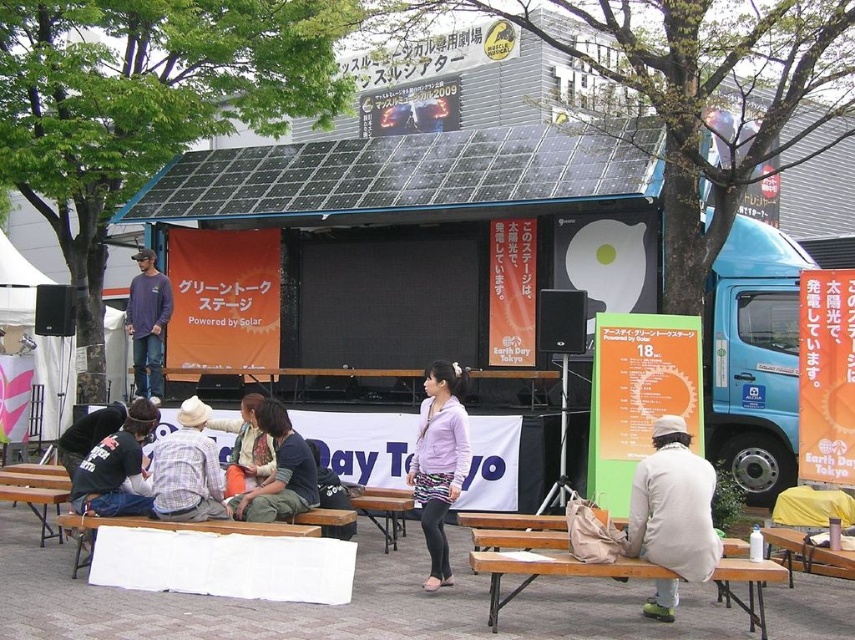
You are attending an Earth Day Tokyo event and notice two jackets on the stage. The white cotton jacket at lower right and the purple matte jacket at center. Which jacket is closer to the ground?

The white cotton jacket at lower right is closer to the ground because it is positioned under the purple matte jacket at center.

You are attending an Earth Day Tokyo event and notice two people on stage. One is wearing a purple matte jacket at center and the other a black hoodie at left. If you want to greet the person who is closer to you, which one should you approach?

The purple matte jacket at center is closer to the viewer than the black hoodie at left, so you should approach the person wearing the purple matte jacket at center.